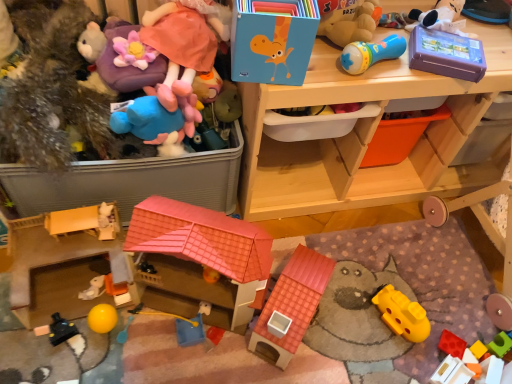
You are a GUI agent. You are given a task and a screenshot of the screen. Output one action in this format:
    pyautogui.click(x=<x>, y=<y>)
    Task: Click on the vacant area that lies between white plastic toy at lower right, arranged as the 3th toy when viewed from the right, and blue plastic toy at center, the 8th toy viewed from the left
    This screenshot has width=512, height=384.
    Given the screenshot: What is the action you would take?
    pyautogui.click(x=315, y=358)